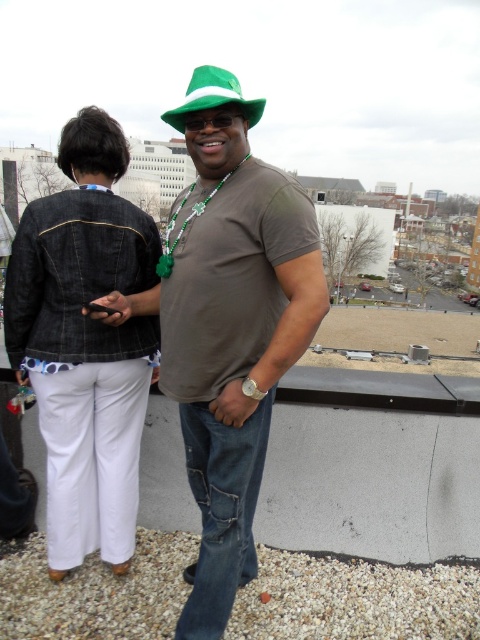
You are a fashion designer observing two hats in the image. The hats are labeled as the green matte hat at center and the green felt fedora at center. Which of these two hats has a smaller width?

The green matte hat at center has a smaller width than the green felt fedora at center.

You are standing on a rooftop platform and want to place a small potted plant between the two points marked as point (79, 284) and point (190, 88). Which point should you use as the closer reference to ensure the plant is nearer to the edge of the platform?

Point (79, 284) is closer to the viewer than point (190, 88), so placing the plant closer to point (79, 284) would position it nearer to the edge of the platform.

You are a photographer standing 1.5 meters away from the green matte hat at center. Can you reach it without moving closer?

The green matte hat at center is 1.65 meters away from the viewer, so you cannot reach it without moving closer since you are currently 1.5 meters away.